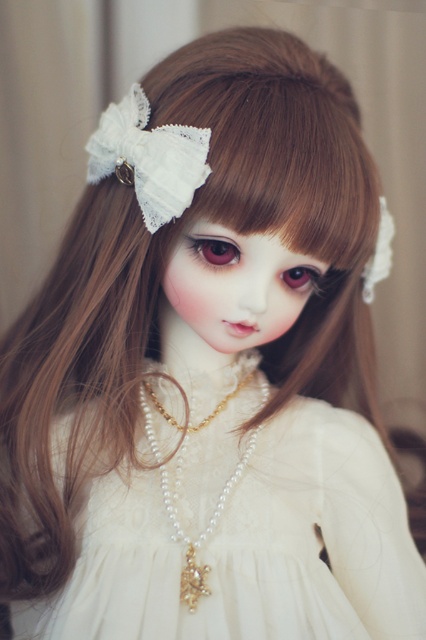
Question: Estimate the real-world distances between objects in this image. Which object is closer to the white lace dress at center?

Choices:
 (A) pearl/golden chain necklace at center
 (B) white lace bow at upper left

Answer: (A)

Question: Is the position of white lace dress at center more distant than that of white lace bow at upper left?

Choices:
 (A) yes
 (B) no

Answer: (A)

Question: Does white lace dress at center have a greater width compared to white lace bow at upper left?

Choices:
 (A) yes
 (B) no

Answer: (A)

Question: Is white lace bow at upper left bigger than pearl/golden chain necklace at center?

Choices:
 (A) yes
 (B) no

Answer: (B)

Question: Among these points, which one is nearest to the camera?

Choices:
 (A) [x=368, y=474]
 (B) [x=150, y=442]

Answer: (B)

Question: Considering the real-world distances, which object is farthest from the white lace bow at upper left?

Choices:
 (A) white lace dress at center
 (B) pearl/golden chain necklace at center

Answer: (A)